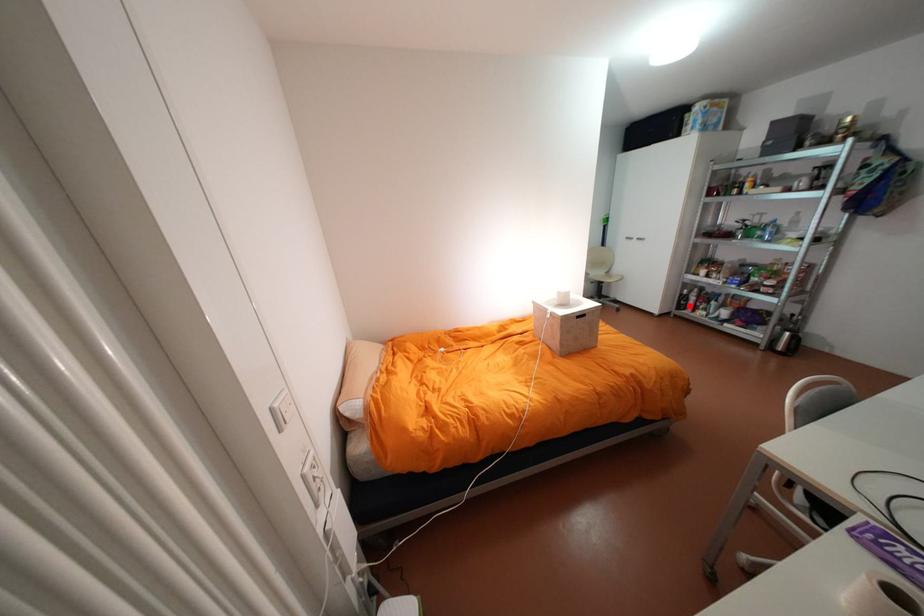
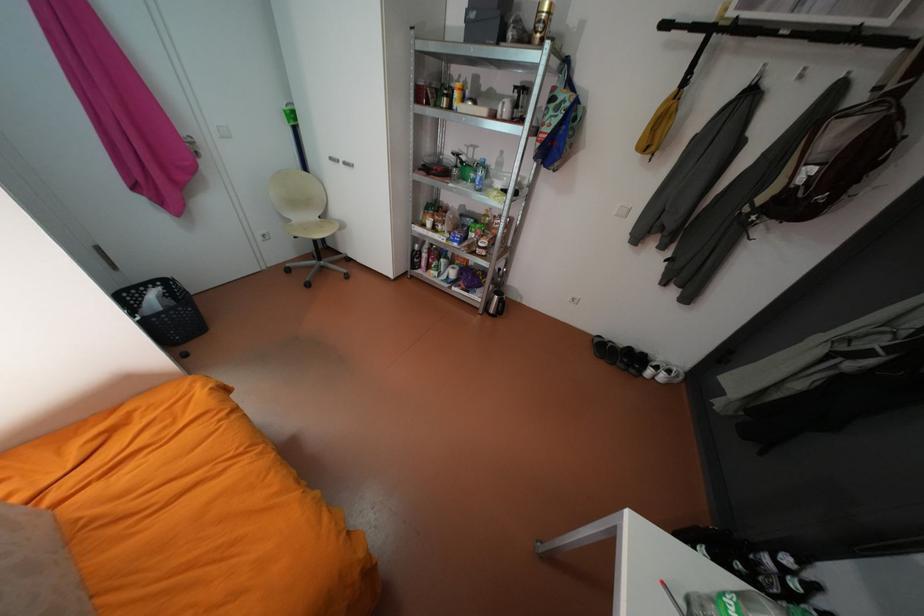
Question: A red point is marked in image1. In image2, is the corresponding 3D point closer to the camera or farther? Reply with the corresponding letter.

Choices:
 (A) The corresponding 3D point is closer.
 (B) The corresponding 3D point is farther.

Answer: (B)